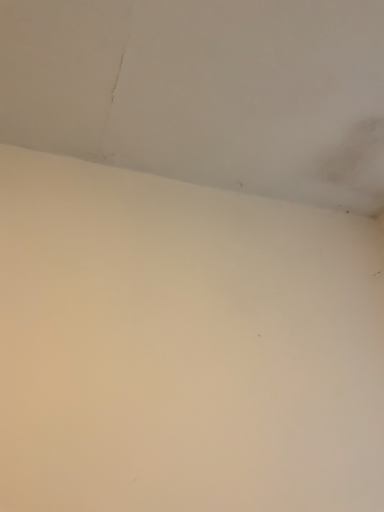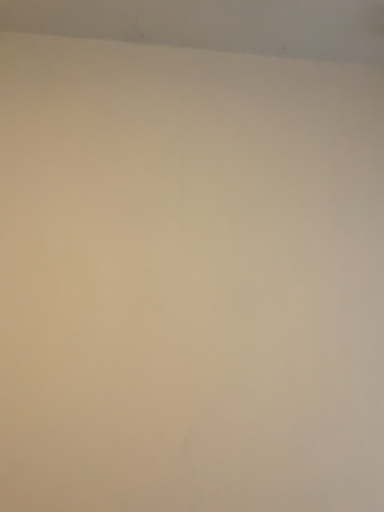
Question: Which way did the camera rotate in the video?

Choices:
 (A) rotated downward
 (B) rotated upward

Answer: (A)